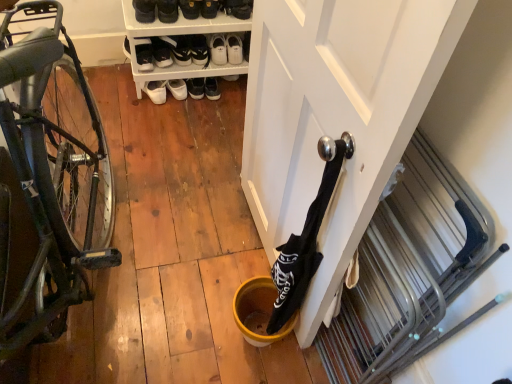
Locate an element on the screen. This screenshot has height=384, width=512. free space in front of white leather shoe at upper center, positioned as the 1th shoe in right-to-left order is located at coordinates (203, 23).